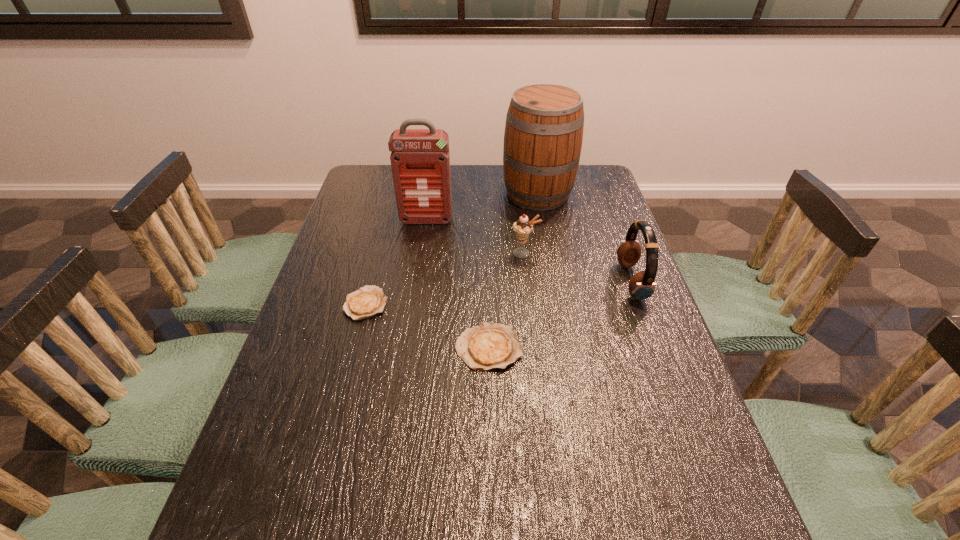
This screenshot has width=960, height=540. In order to click on vacant spot to place a quiche on the right in this screenshot , I will do `click(637, 402)`.